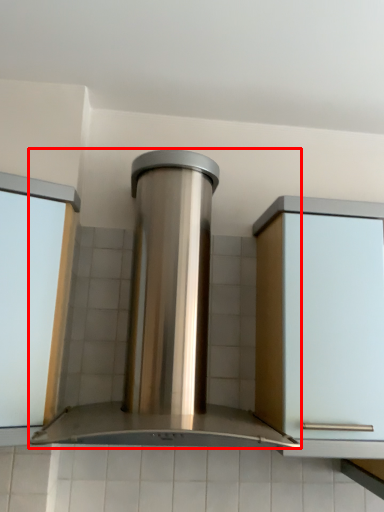
Question: From the image's perspective, where is home appliance (annotated by the red box) located in relation to window frame in the image?

Choices:
 (A) above
 (B) below

Answer: (A)